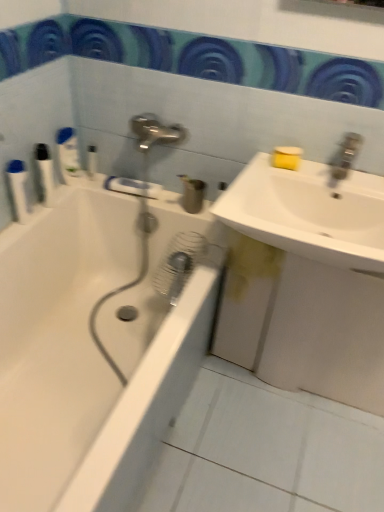
The height and width of the screenshot is (512, 384). I want to click on unoccupied region to the right of satin nickel faucet at upper right, so click(x=369, y=180).